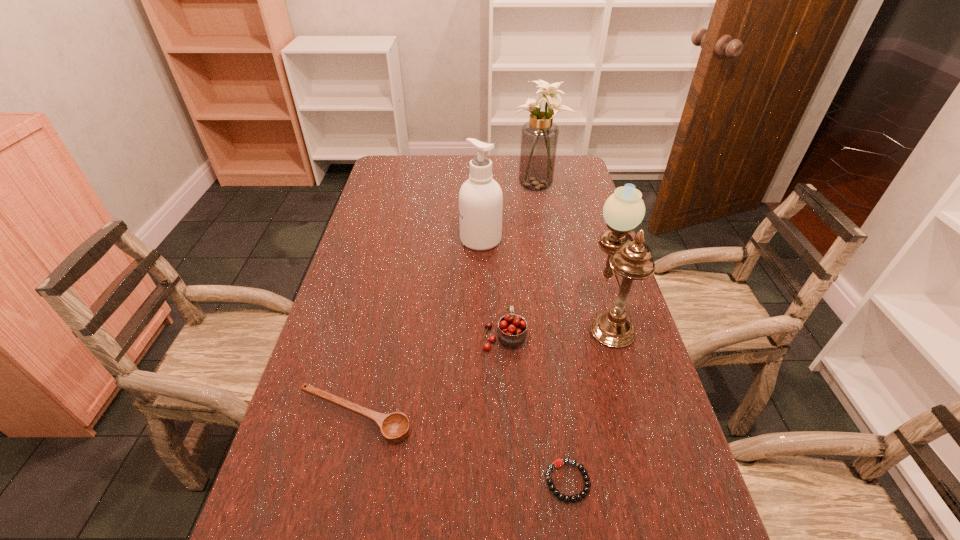
Locate an element on the screen. flower arrangement present at the right edge is located at coordinates (539, 136).

Locate an element on the screen. oil lamp that is positioned at the right edge is located at coordinates (624, 210).

Find the location of a particular element. The width and height of the screenshot is (960, 540). object that is at the far right corner is located at coordinates [x=539, y=136].

Locate an element on the screen. The image size is (960, 540). free location at the far edge of the desktop is located at coordinates (455, 171).

Where is `vacant area at the left edge`? This screenshot has width=960, height=540. vacant area at the left edge is located at coordinates [x=364, y=387].

At what (x,y) coordinates should I click in order to perform the action: click on vacant space at the right edge. Please return your answer as a coordinate pair (x, y). The height and width of the screenshot is (540, 960). Looking at the image, I should click on (571, 217).

Locate an element on the screen. Image resolution: width=960 pixels, height=540 pixels. vacant area at the far left corner is located at coordinates (385, 181).

This screenshot has width=960, height=540. In the image, there is a desktop. What are the coordinates of `vacant area at the far right corner` in the screenshot? It's located at (572, 177).

At what (x,y) coordinates should I click in order to perform the action: click on empty location between the bracelet and the leftmost object. Please return your answer as a coordinate pair (x, y). Looking at the image, I should click on (461, 449).

The width and height of the screenshot is (960, 540). Identify the location of blank region between the cleansing agent and the oil lamp. (544, 277).